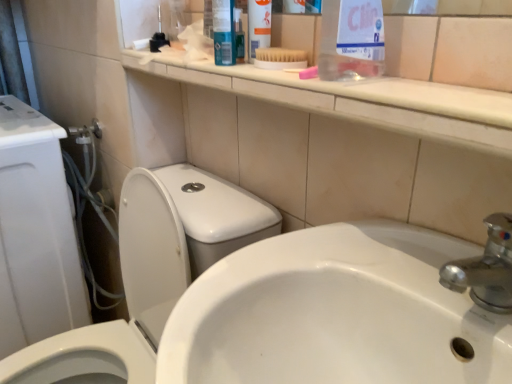
Question: Visually, is white glossy toilet at left positioned to the left or to the right of white plastic brush at upper center?

Choices:
 (A) left
 (B) right

Answer: (A)

Question: Choose the correct answer: Is white glossy toilet at left inside white plastic brush at upper center or outside it?

Choices:
 (A) outside
 (B) inside

Answer: (A)

Question: Based on their relative distances, which object is farther from the white glossy toilet at left?

Choices:
 (A) white glossy toilet at left
 (B) white glossy sink at lower left
 (C) white plastic brush at upper center
 (D) clear plastic bottle at upper center

Answer: (D)

Question: Estimate the real-world distances between objects in this image. Which object is closer to the clear plastic bottle at upper center?

Choices:
 (A) white glossy sink at lower left
 (B) white glossy toilet at left
 (C) white plastic brush at upper center
 (D) white glossy toilet at left

Answer: (C)